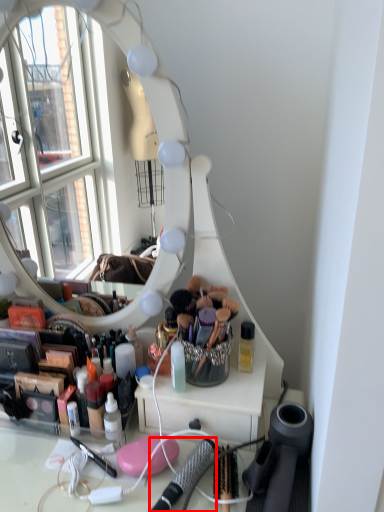
Question: Considering the relative positions of brush (annotated by the red box) and toiletry in the image provided, where is brush (annotated by the red box) located with respect to the staircase?

Choices:
 (A) right
 (B) left

Answer: (A)